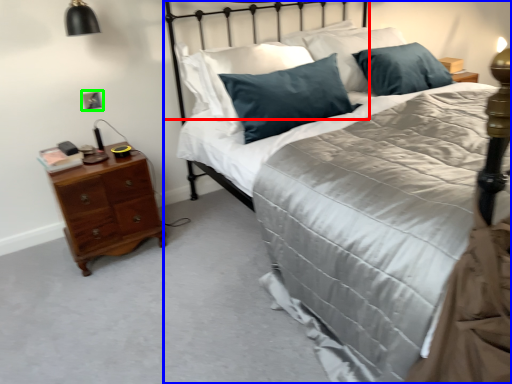
Question: Which object is positioned farthest from headboard (highlighted by a red box)? Select from bed (highlighted by a blue box) and electric outlet (highlighted by a green box).

Choices:
 (A) bed
 (B) electric outlet

Answer: (A)